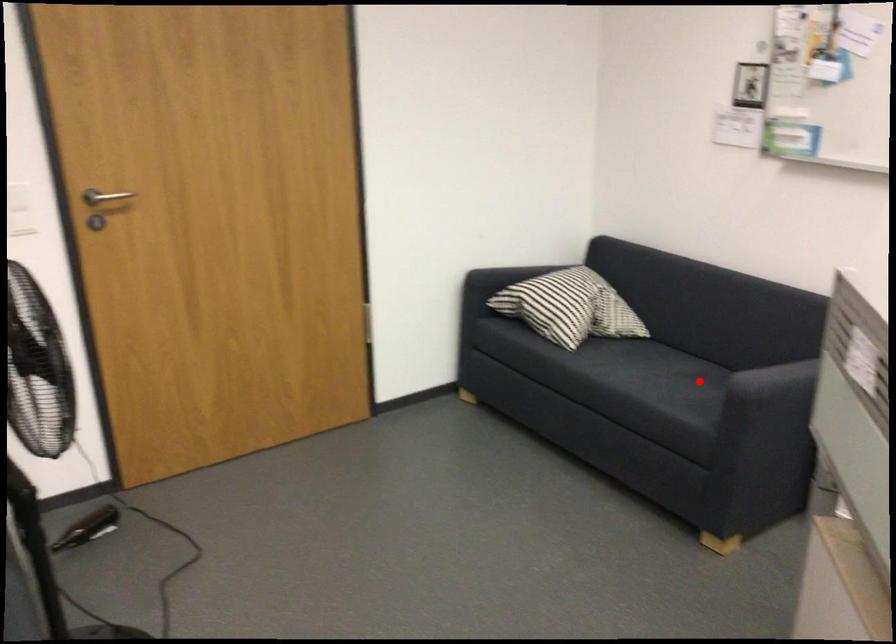
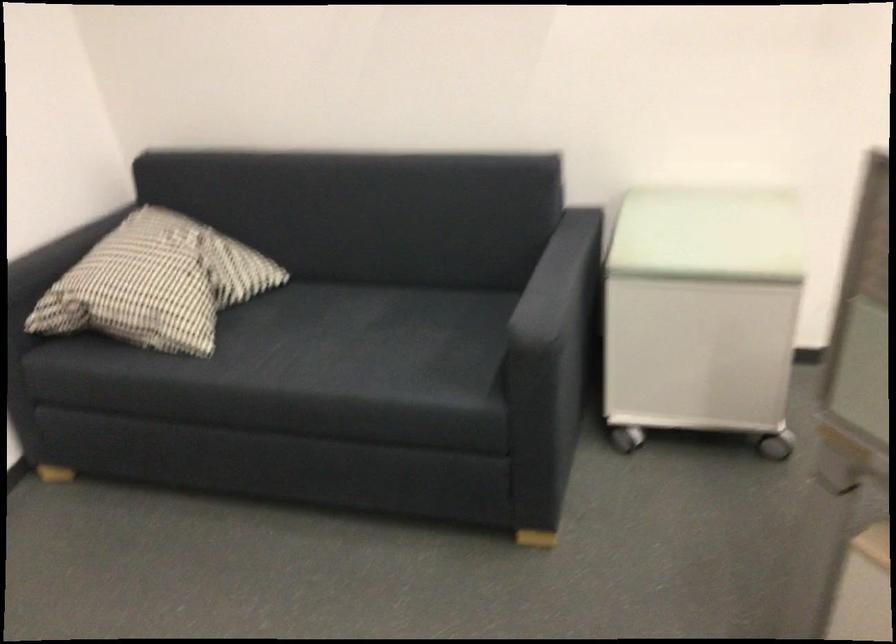
Question: I am providing you with two images of the same scene from different viewpoints. Image1 has a red point marked. In image2, the corresponding 3D location appears at what relative position? Reply with the corresponding letter.

Choices:
 (A) Closer
 (B) Farther

Answer: (A)